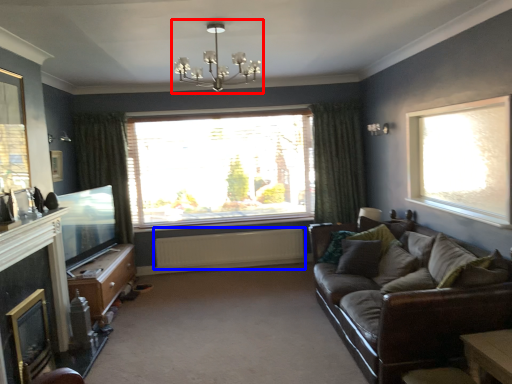
Question: Which of the following is the closest to the observer, light fixture (highlighted by a red box) or radiator (highlighted by a blue box)?

Choices:
 (A) light fixture
 (B) radiator

Answer: (A)